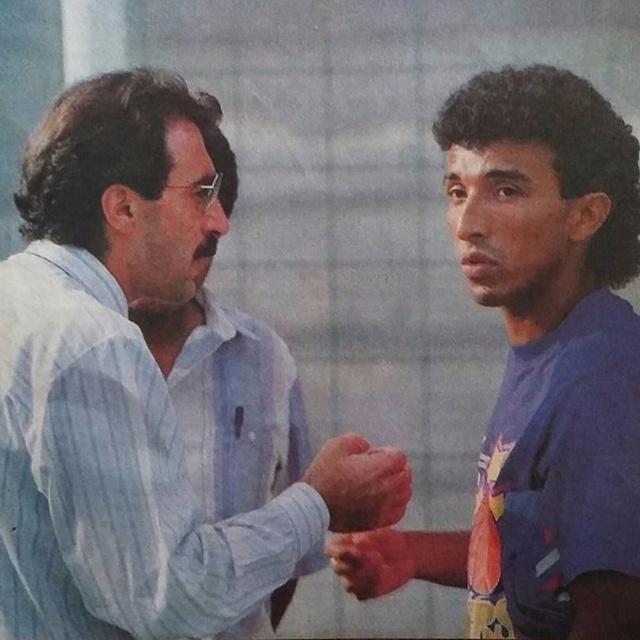
How distant is matte skin hand at center from smooth skin hand at center?

A distance of 5.88 inches exists between matte skin hand at center and smooth skin hand at center.

Does matte skin hand at center have a lesser height compared to smooth skin hand at center?

No, matte skin hand at center is not shorter than smooth skin hand at center.

Is point (394, 512) in front of point (381, 595)?

Yes, point (394, 512) is in front of point (381, 595).

Where is `matte skin hand at center`? The image size is (640, 640). matte skin hand at center is located at coordinates (358, 483).

Is blue striped shirt at center above matte skin hand at center?

Yes.

Does blue striped shirt at center appear under matte skin hand at center?

No, blue striped shirt at center is not below matte skin hand at center.

Describe the element at coordinates (116, 385) in the screenshot. The image size is (640, 640). I see `blue striped shirt at center` at that location.

Locate an element on the screen. blue striped shirt at center is located at coordinates (116, 385).

Which is behind, point (120, 81) or point (372, 576)?

The point (372, 576) is behind.

Is point (81, 481) farther from camera compared to point (380, 579)?

No.

Does point (150, 596) lie behind point (364, 588)?

No, (150, 596) is closer to viewer.

At what (x,y) coordinates should I click in order to perform the action: click on blue striped shirt at center. Please return your answer as a coordinate pair (x, y). The image size is (640, 640). Looking at the image, I should click on (116, 385).